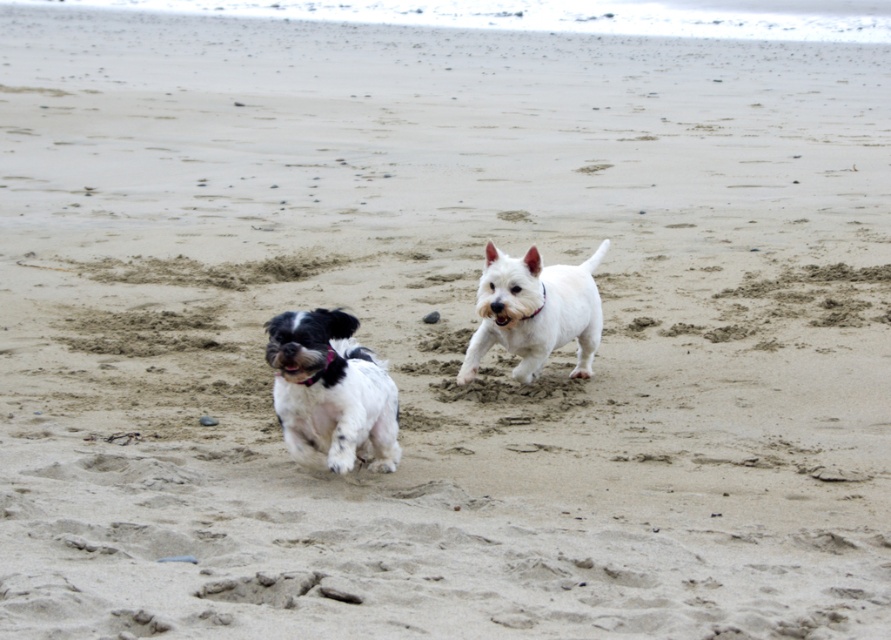
Question: Among these points, which one is farthest from the camera?

Choices:
 (A) (508, 288)
 (B) (360, 358)

Answer: (A)

Question: Which object is closer to the camera taking this photo?

Choices:
 (A) black and white fur dog at left
 (B) white smooth dog at center

Answer: (A)

Question: Which point is farther to the camera?

Choices:
 (A) black and white fur dog at left
 (B) white smooth dog at center

Answer: (B)

Question: Is black and white fur dog at left positioned at the back of white smooth dog at center?

Choices:
 (A) no
 (B) yes

Answer: (A)

Question: Can you confirm if black and white fur dog at left is positioned to the left of white smooth dog at center?

Choices:
 (A) no
 (B) yes

Answer: (B)

Question: Is the position of black and white fur dog at left less distant than that of white smooth dog at center?

Choices:
 (A) no
 (B) yes

Answer: (B)